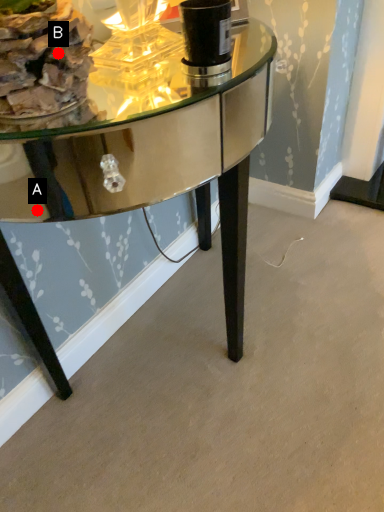
Question: Two points are circled on the image, labeled by A and B beside each circle. Among these points, which one is nearest to the camera?

Choices:
 (A) A is closer
 (B) B is closer

Answer: (B)